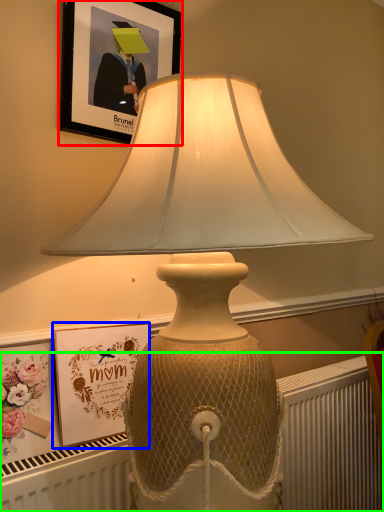
Question: Based on their relative distances, which object is farther from picture frame (highlighted by a red box)? Choose from picture frame (highlighted by a blue box) and radiator (highlighted by a green box).

Choices:
 (A) picture frame
 (B) radiator

Answer: (B)